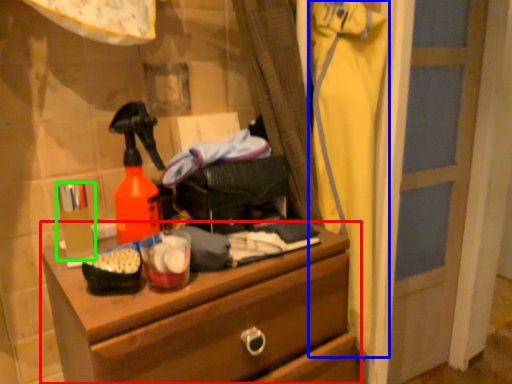
Question: Which object is the closest to the chest of drawers (highlighted by a red box)? Choose among these: clothing (highlighted by a blue box) or toiletry (highlighted by a green box).

Choices:
 (A) clothing
 (B) toiletry

Answer: (B)